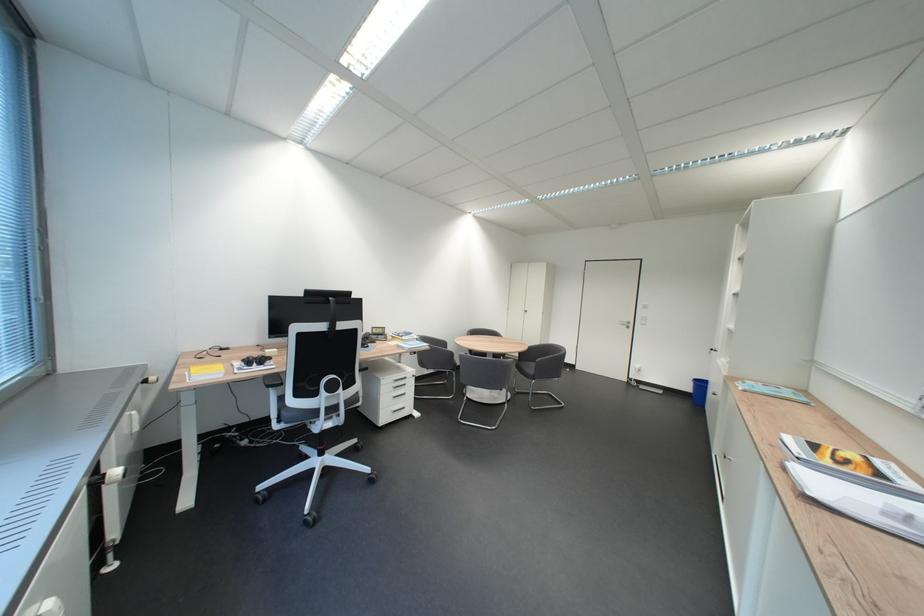
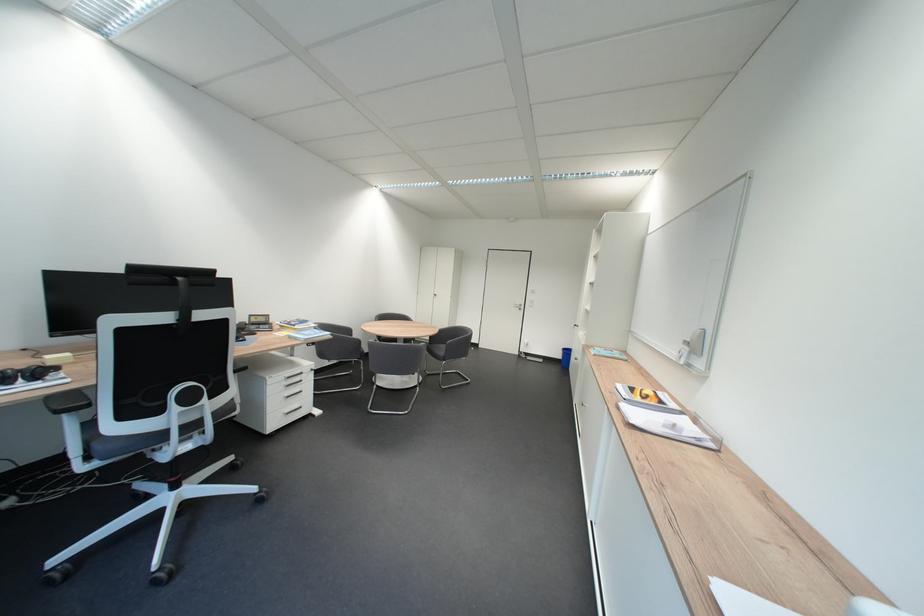
The point at (528, 395) is marked in the first image. Where is the corresponding point in the second image?

(439, 378)